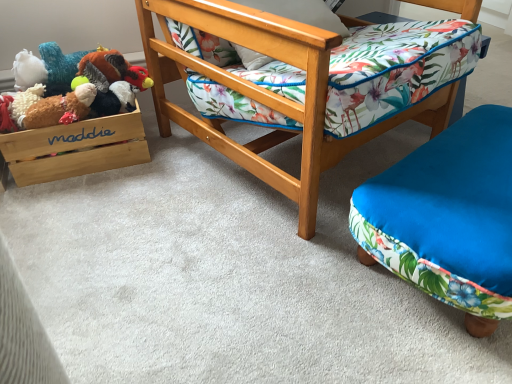
This screenshot has width=512, height=384. In order to click on free location to the left of blue fabric ottoman at lower right in this screenshot , I will do `click(279, 261)`.